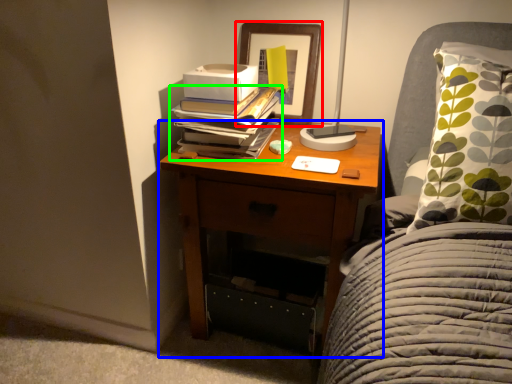
Question: Which is nearer to the picture frame (highlighted by a red box)? nightstand (highlighted by a blue box) or book (highlighted by a green box).

Choices:
 (A) nightstand
 (B) book

Answer: (B)